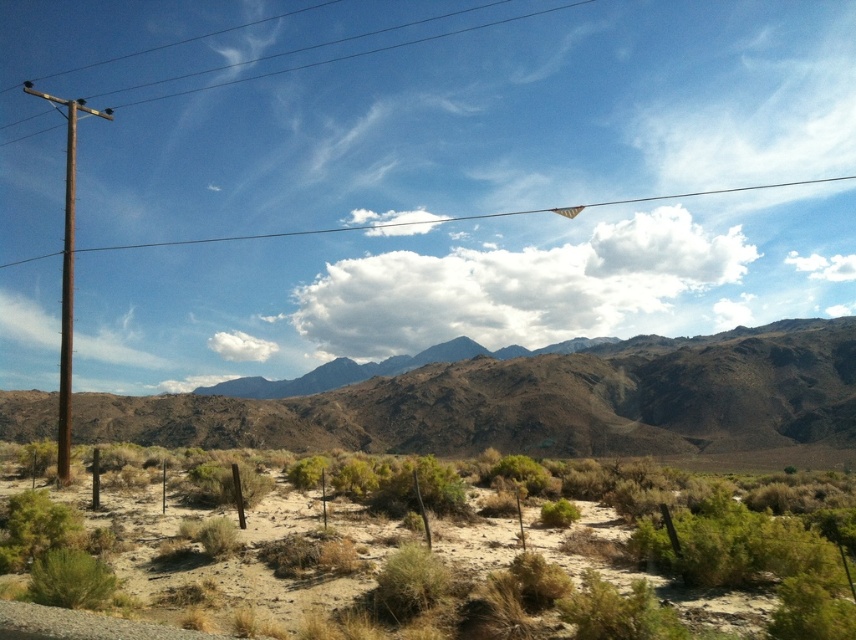
Consider the image. You are a hiker planning to take a photo of the brown rocky mountain range at center and the brown wooden pole at left. Which object should you position closer to the camera to ensure both are in focus?

The brown rocky mountain range at center is shorter than the brown wooden pole at left, so you should position the brown wooden pole at left closer to the camera to ensure both are in focus.

You are a hiker standing at the base of the brown rocky mountain range at center. You want to take a photo of the mountain range from a specific location that is exactly 1 meter away from its current position. Is this possible?

The brown rocky mountain range at center is located at point [539,401], so you can move 1 meter away from that point to take the photo.